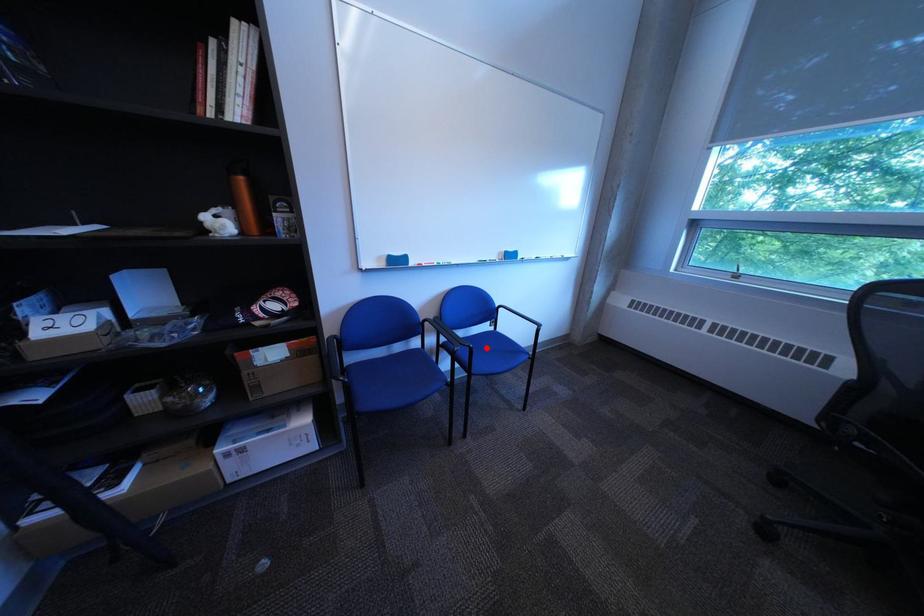
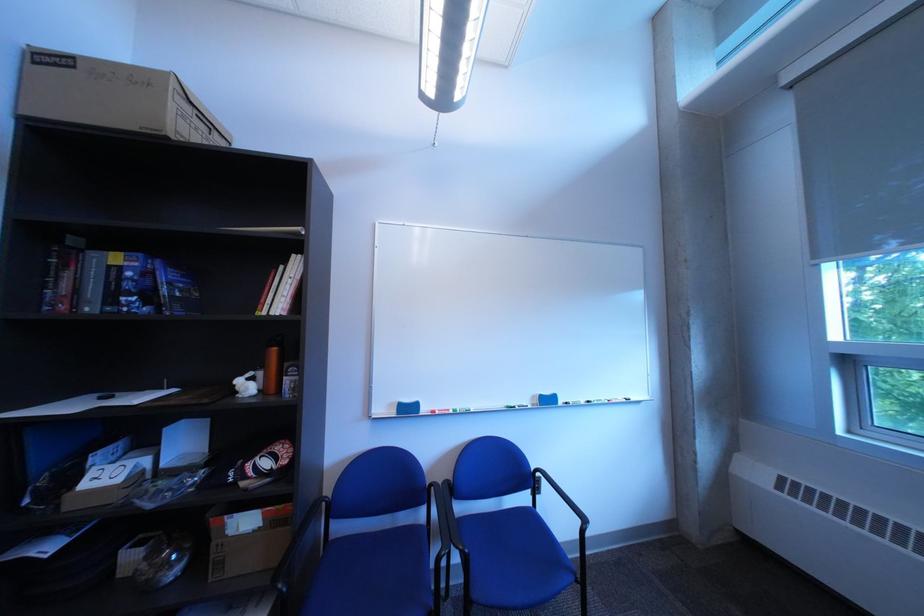
Where in the second image is the point corresponding to the highlighted location from the first image?

(482, 553)